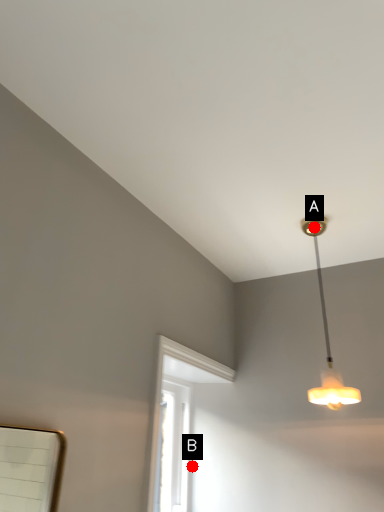
Question: Two points are circled on the image, labeled by A and B beside each circle. Which point appears closest to the camera in this image?

Choices:
 (A) A is closer
 (B) B is closer

Answer: (A)